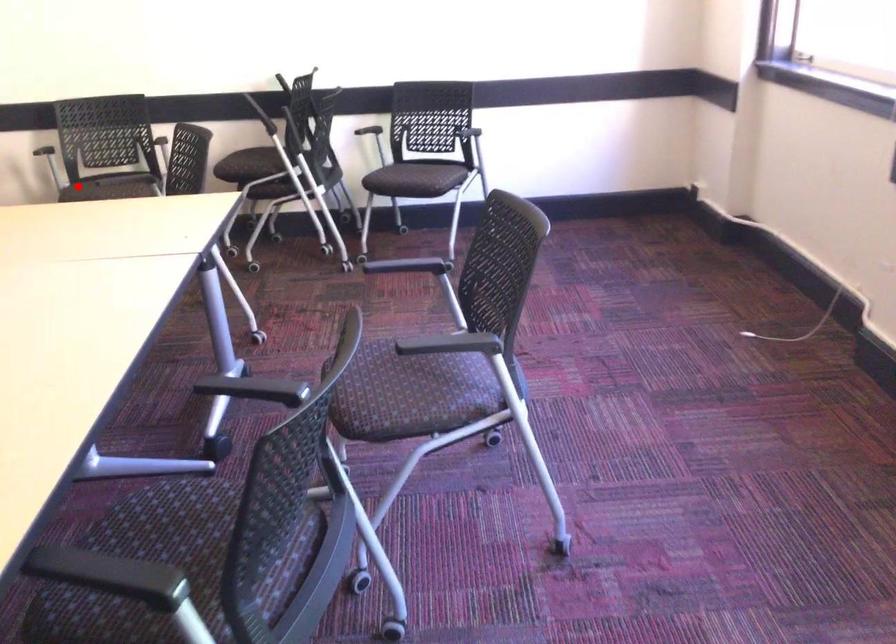
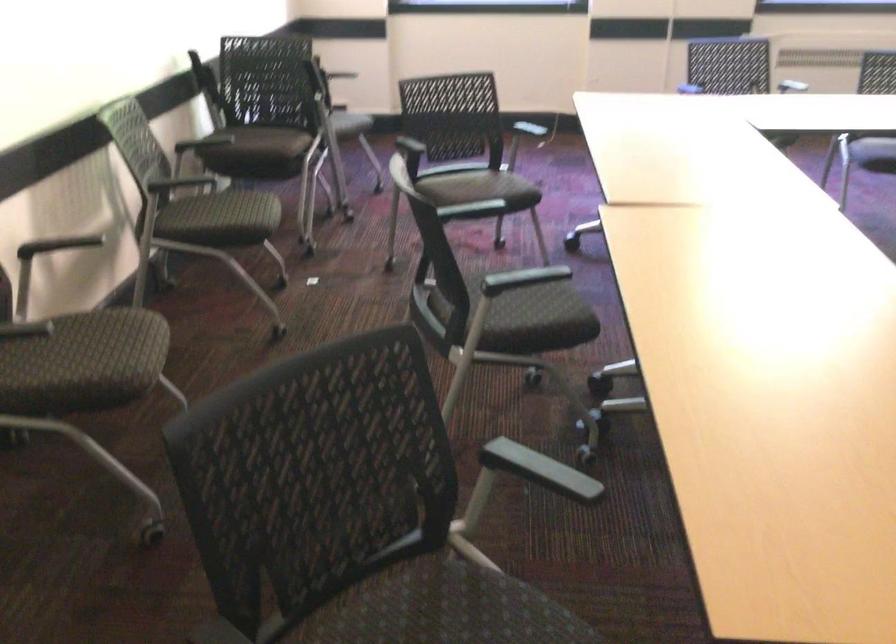
Locate, in the second image, the point that corresponds to the highlighted location in the first image.

(250, 216)